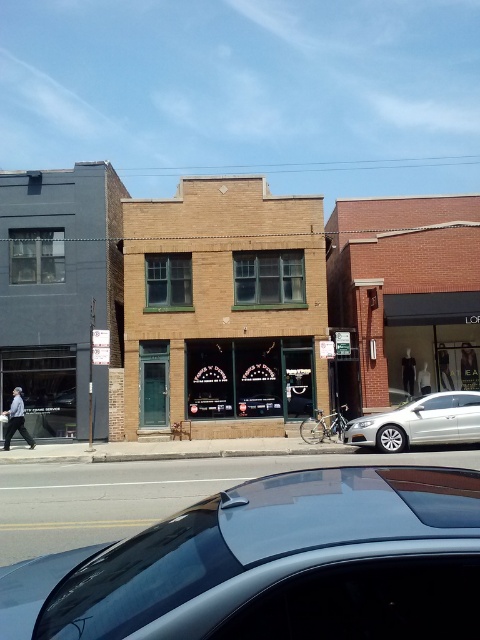
Can you confirm if metallic blue car at center is smaller than silver metallic sedan at lower right?

Yes, metallic blue car at center is smaller than silver metallic sedan at lower right.

Which is in front, point (21, 593) or point (443, 432)?

Positioned in front is point (21, 593).

At what (x,y) coordinates should I click in order to perform the action: click on metallic blue car at center. Please return your answer as a coordinate pair (x, y). This screenshot has width=480, height=640. Looking at the image, I should click on (274, 564).

Who is higher up, brown brick building at center or dark gray concrete building at left?

Positioned higher is dark gray concrete building at left.

Is point (165, 403) more distant than point (108, 269)?

No, (165, 403) is in front of (108, 269).

Is point (248, 387) positioned after point (13, 349)?

That is True.

At what (x,y) coordinates should I click in order to perform the action: click on brown brick building at center. Please return your answer as a coordinate pair (x, y). This screenshot has width=480, height=640. Looking at the image, I should click on (223, 308).

Between point (10, 378) and point (472, 412), which one is positioned in front?

Point (472, 412)

Does dark gray concrete building at left have a greater width compared to silver metallic sedan at lower right?

Yes, dark gray concrete building at left is wider than silver metallic sedan at lower right.

Does point (75, 211) come closer to viewer compared to point (435, 403)?

No.

Identify the location of dark gray concrete building at left. Image resolution: width=480 pixels, height=640 pixels. [61, 296].